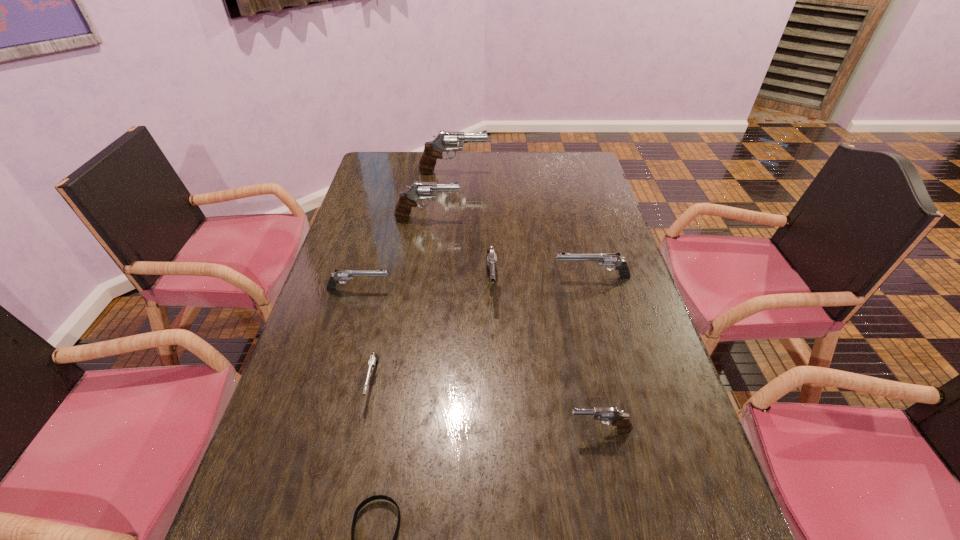
At what (x,y) coordinates should I click in order to perform the action: click on vacant space located 0.350m at the barrel of the second nearest object. Please return your answer as a coordinate pair (x, y). The height and width of the screenshot is (540, 960). Looking at the image, I should click on (405, 430).

Find the location of a particular element. This screenshot has width=960, height=540. vacant region located 0.260m at the barrel of the second nearest object is located at coordinates (447, 430).

Where is `free space located at the barrel of the second nearest object`? The width and height of the screenshot is (960, 540). free space located at the barrel of the second nearest object is located at coordinates (410, 430).

Find the location of a particular element. vacant region located on the front-facing side of the second smallest silver pistol is located at coordinates (492, 289).

Find the location of a particular element. vacant region located on the front-facing side of the smallest silver pistol is located at coordinates (352, 479).

Locate an element on the screen. Image resolution: width=960 pixels, height=540 pixels. object that is at the far edge is located at coordinates (433, 150).

Identify the location of free space at the far edge of the desktop. (502, 165).

In the image, there is a desktop. At what (x,y) coordinates should I click in order to perform the action: click on free space at the left edge. Please return your answer as a coordinate pair (x, y). The width and height of the screenshot is (960, 540). Looking at the image, I should click on (300, 485).

This screenshot has width=960, height=540. In the image, there is a desktop. Find the location of `vacant space at the right edge`. vacant space at the right edge is located at coordinates (613, 234).

Image resolution: width=960 pixels, height=540 pixels. In order to click on free space at the far right corner of the desktop in this screenshot , I will do `click(565, 156)`.